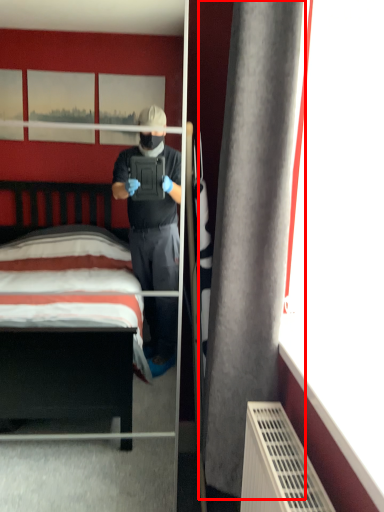
Question: From the image's perspective, what is the correct spatial relationship of curtain (annotated by the red box) in relation to mirror?

Choices:
 (A) below
 (B) above

Answer: (B)